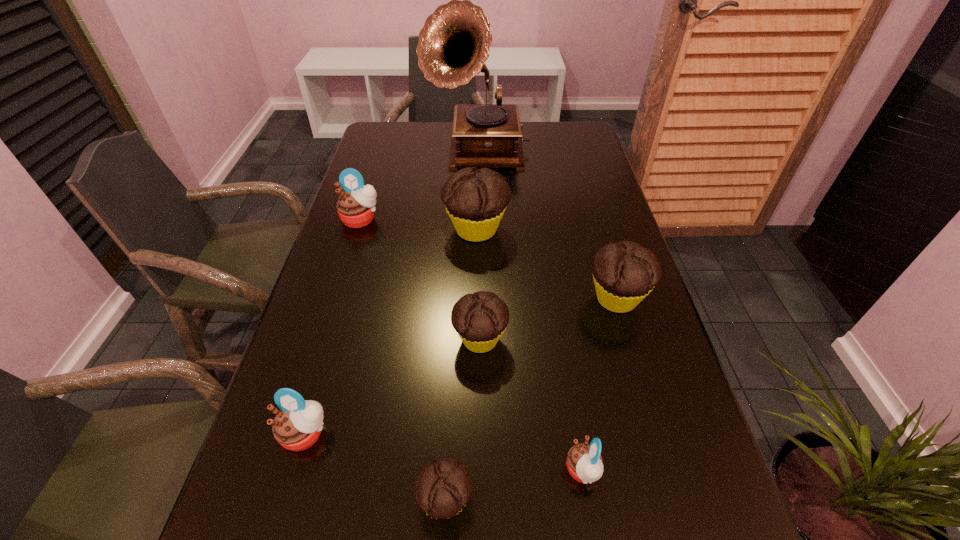
Identify which chocolate muffin is located as the nearest to the smallest chocolate muffin. Please provide its 2D coordinates. Your answer should be formatted as a tuple, i.e. [(x, y)], where the tuple contains the x and y coordinates of a point satisfying the conditions above.

[(480, 319)]

In order to click on chocolate muffin object that ranks as the second closest to the rightmost muffin in this screenshot , I will do `click(475, 199)`.

Identify which pink muffin is the nearest to the second smallest pink muffin. Please provide its 2D coordinates. Your answer should be formatted as a tuple, i.e. [(x, y)], where the tuple contains the x and y coordinates of a point satisfying the conditions above.

[(584, 462)]

Image resolution: width=960 pixels, height=540 pixels. Find the location of `pink muffin that is the second nearest to the rightmost chocolate muffin`. pink muffin that is the second nearest to the rightmost chocolate muffin is located at coordinates (355, 207).

Where is `free space that satisfies the following two spatial constraints: 1. on the front-facing side of the nearest chocolate muffin; 2. on the left side of the farthest pink muffin`? Image resolution: width=960 pixels, height=540 pixels. free space that satisfies the following two spatial constraints: 1. on the front-facing side of the nearest chocolate muffin; 2. on the left side of the farthest pink muffin is located at coordinates [x=274, y=500].

Identify the location of vacant space that satisfies the following two spatial constraints: 1. on the back side of the nearest chocolate muffin; 2. on the left side of the second smallest chocolate muffin. (454, 339).

The height and width of the screenshot is (540, 960). In order to click on vacant area in the image that satisfies the following two spatial constraints: 1. on the front-facing side of the farthest chocolate muffin; 2. on the right side of the farthest pink muffin in this screenshot , I will do `click(358, 230)`.